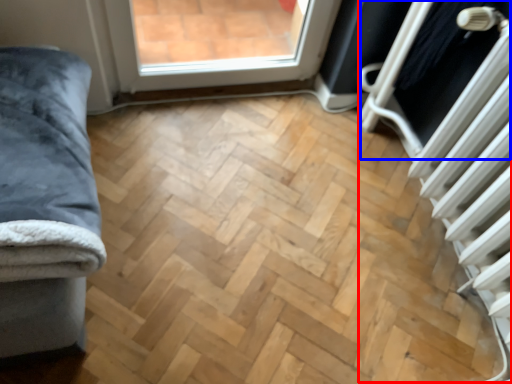
Question: Which of the following is the closest to the observer, radiator (highlighted by a red box) or screen door (highlighted by a blue box)?

Choices:
 (A) radiator
 (B) screen door

Answer: (A)